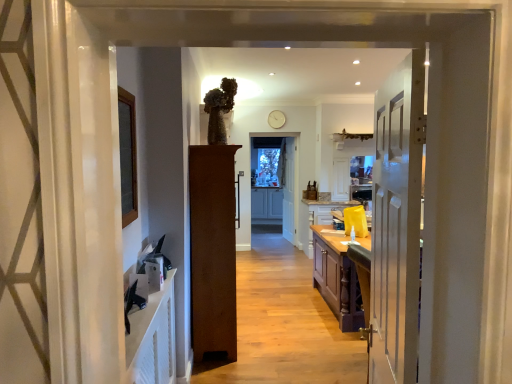
Question: In which direction should I rotate to look at brown wood cabinet at center, which appears as the 3th door when viewed from the right?

Choices:
 (A) right
 (B) left

Answer: (B)

Question: Is yellow matte cabinet at center, placed as the second cabinetry when sorted from back to front, to the left of brown wood cabinet at center, the second door when ordered from front to back, from the viewer's perspective?

Choices:
 (A) yes
 (B) no

Answer: (B)

Question: Is yellow matte cabinet at center, the first cabinetry viewed from the right, at the right side of brown wood cabinet at center, which appears as the 3th door when viewed from the right?

Choices:
 (A) no
 (B) yes

Answer: (B)

Question: Does yellow matte cabinet at center, marked as the first cabinetry in a front-to-back arrangement, have a greater height compared to brown wood cabinet at center, which appears as the first door when viewed from the left?

Choices:
 (A) yes
 (B) no

Answer: (B)

Question: Is yellow matte cabinet at center, the 2th cabinetry positioned from the left, located outside brown wood cabinet at center, the second door when ordered from front to back?

Choices:
 (A) yes
 (B) no

Answer: (A)

Question: Is the surface of yellow matte cabinet at center, the 2th cabinetry positioned from the left, in direct contact with brown wood cabinet at center, the second door when ordered from front to back?

Choices:
 (A) yes
 (B) no

Answer: (B)

Question: Considering the relative sizes of yellow matte cabinet at center, placed as the second cabinetry when sorted from back to front, and brown wood cabinet at center, which is counted as the 2th door, starting from the back, in the image provided, is yellow matte cabinet at center, placed as the second cabinetry when sorted from back to front, thinner than brown wood cabinet at center, which is counted as the 2th door, starting from the back,?

Choices:
 (A) yes
 (B) no

Answer: (B)

Question: Is white painted wood door at right, which ranks as the 2th door in right-to-left order, oriented towards yellow matte cabinet at center, placed as the second cabinetry when sorted from back to front?

Choices:
 (A) no
 (B) yes

Answer: (A)

Question: Does white painted wood door at right, marked as the second door in a left-to-right arrangement, have a lesser width compared to yellow matte cabinet at center, marked as the first cabinetry in a front-to-back arrangement?

Choices:
 (A) no
 (B) yes

Answer: (B)

Question: Can you confirm if white painted wood door at right, which is counted as the third door, starting from the back, is wider than yellow matte cabinet at center, marked as the first cabinetry in a front-to-back arrangement?

Choices:
 (A) yes
 (B) no

Answer: (B)

Question: From the image's perspective, is white painted wood door at right, which is counted as the third door, starting from the back, beneath yellow matte cabinet at center, marked as the first cabinetry in a front-to-back arrangement?

Choices:
 (A) yes
 (B) no

Answer: (B)

Question: From the image's perspective, would you say white painted wood door at right, which is counted as the third door, starting from the back, is positioned over yellow matte cabinet at center, the 2th cabinetry positioned from the left?

Choices:
 (A) yes
 (B) no

Answer: (A)

Question: Considering the relative sizes of white painted wood door at right, which ranks as the 2th door in right-to-left order, and yellow matte cabinet at center, the 2th cabinetry positioned from the left, in the image provided, is white painted wood door at right, which ranks as the 2th door in right-to-left order, bigger than yellow matte cabinet at center, the 2th cabinetry positioned from the left,?

Choices:
 (A) yes
 (B) no

Answer: (B)

Question: From the image's perspective, would you say matte gray cabinetry at center, which is counted as the first cabinetry, starting from the left, is positioned over white painted wood door at right, marked as the second door in a left-to-right arrangement?

Choices:
 (A) no
 (B) yes

Answer: (A)